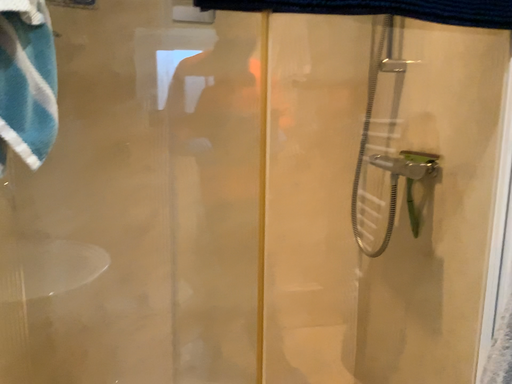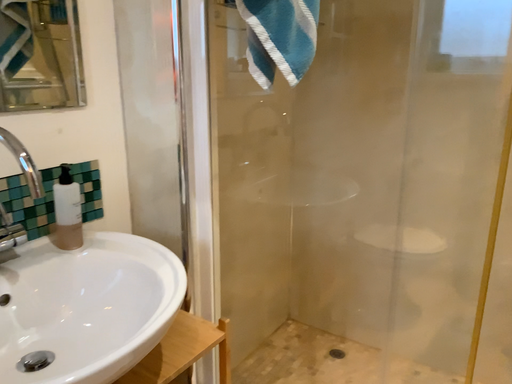
Question: How did the camera likely rotate when shooting the video?

Choices:
 (A) rotated right
 (B) rotated left

Answer: (B)